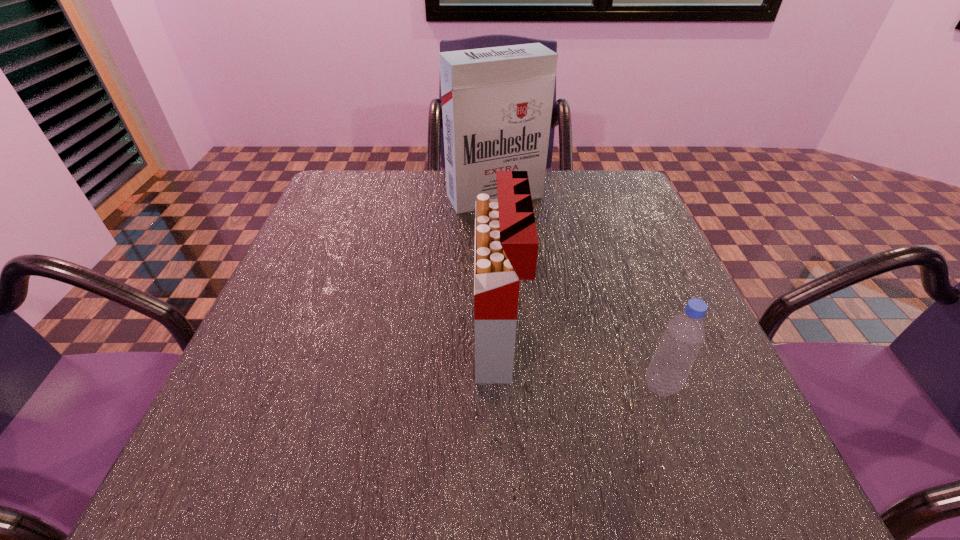
This screenshot has width=960, height=540. I want to click on the tallest object, so click(x=497, y=102).

Identify the location of the farthest object. (497, 102).

Locate an element on the screen. Image resolution: width=960 pixels, height=540 pixels. the shorter cigarette case is located at coordinates (506, 242).

I want to click on the nearer cigarette case, so click(x=506, y=242).

Locate an element on the screen. This screenshot has height=540, width=960. the rightmost object is located at coordinates (684, 335).

Where is `the shortest object`? the shortest object is located at coordinates (684, 335).

Where is `free space located 0.350m on the front of the farther cigarette case`? free space located 0.350m on the front of the farther cigarette case is located at coordinates (500, 316).

Locate an element on the screen. free point located with the lid open on the second shortest object is located at coordinates (398, 341).

This screenshot has height=540, width=960. I want to click on free space located 0.070m with the lid open on the second shortest object, so click(x=437, y=341).

Identify the location of free space located 0.110m with the lid open on the second shortest object. This screenshot has width=960, height=540. (415, 341).